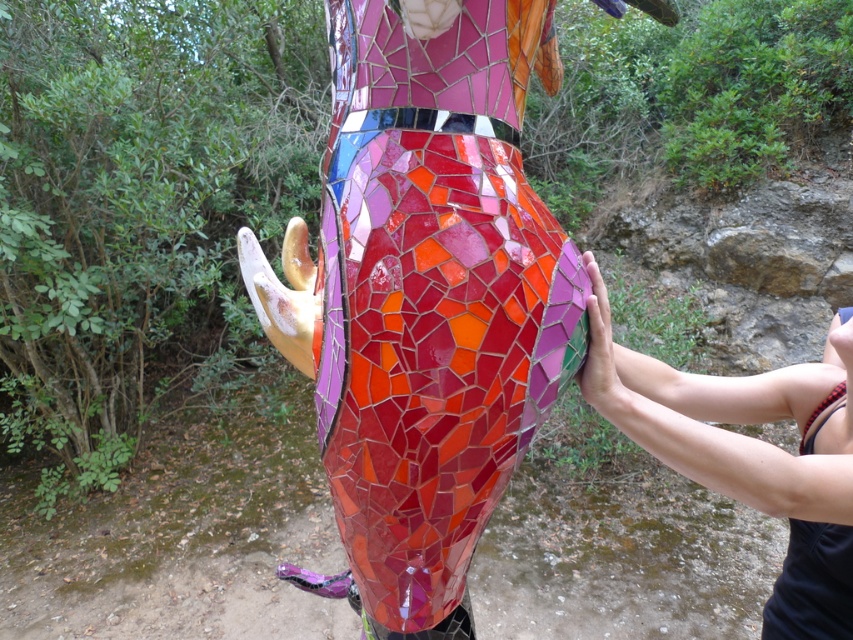
Question: Is mosaic glass sculpture at center thinner than pink mosaic ball at right?

Choices:
 (A) yes
 (B) no

Answer: (B)

Question: Which object is closer to the camera taking this photo?

Choices:
 (A) pink mosaic ball at right
 (B) mosaic glass sculpture at center

Answer: (B)

Question: Which point is closer to the camera?

Choices:
 (A) (434, 356)
 (B) (714, 412)

Answer: (A)

Question: Is mosaic glass sculpture at center smaller than pink mosaic ball at right?

Choices:
 (A) no
 (B) yes

Answer: (A)

Question: Which point is closer to the camera taking this photo?

Choices:
 (A) (796, 550)
 (B) (451, 483)

Answer: (B)

Question: From the image, what is the correct spatial relationship of mosaic glass sculpture at center in relation to pink mosaic ball at right?

Choices:
 (A) left
 (B) right

Answer: (A)